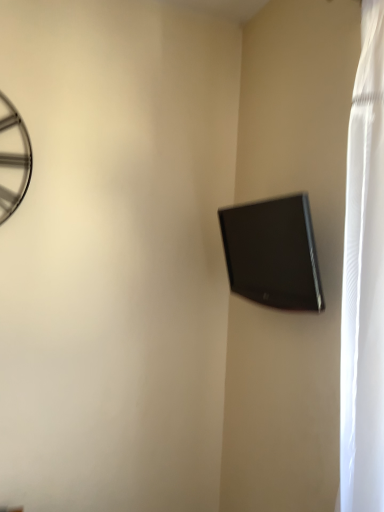
The width and height of the screenshot is (384, 512). What do you see at coordinates (273, 253) in the screenshot?
I see `matte black tv at upper right` at bounding box center [273, 253].

You are a GUI agent. You are given a task and a screenshot of the screen. Output one action in this format:
    pyautogui.click(x=<x>, y=<y>)
    Task: Click on the matte black tv at upper right
    The image size is (384, 512).
    Given the screenshot: What is the action you would take?
    pyautogui.click(x=273, y=253)

Measure the distance between point (310, 225) and camera.

Point (310, 225) and camera are 1.29 meters apart from each other.

You are a GUI agent. You are given a task and a screenshot of the screen. Output one action in this format:
    pyautogui.click(x=<x>, y=<y>)
    Task: Click on the matte black tv at upper right
    
    Given the screenshot: What is the action you would take?
    pyautogui.click(x=273, y=253)